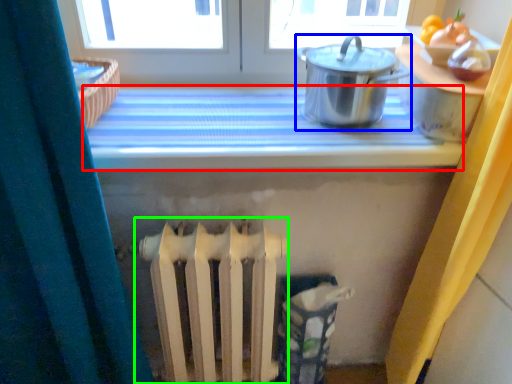
Question: Which object is the closest to the counter top (highlighted by a red box)? Choose among these: kitchen appliance (highlighted by a blue box) or radiator (highlighted by a green box).

Choices:
 (A) kitchen appliance
 (B) radiator

Answer: (A)